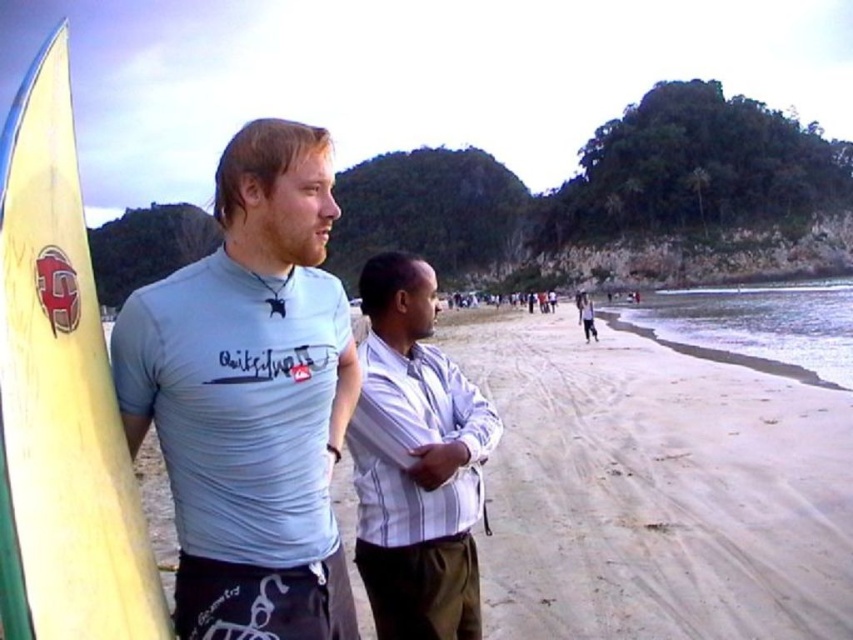
Is point (323, 387) positioned after point (119, 541)?

Yes.

Does point (297, 147) come closer to viewer compared to point (82, 484)?

No, it is not.

Find the location of a particular element. This screenshot has height=640, width=853. light blue fabric shirt at left is located at coordinates (250, 396).

Does yellow matte surfboard at left appear on the left side of white striped shirt at center?

Yes, yellow matte surfboard at left is to the left of white striped shirt at center.

Is yellow matte surfboard at left thinner than white striped shirt at center?

Incorrect, yellow matte surfboard at left's width is not less than white striped shirt at center's.

Is point (62, 150) positioned before point (419, 515)?

Yes, it is in front of point (419, 515).

Where is `yellow matte surfboard at left`? Image resolution: width=853 pixels, height=640 pixels. yellow matte surfboard at left is located at coordinates (61, 397).

Who is lower down, light blue fabric shirt at left or white striped shirt at center?

white striped shirt at center is lower down.

Which of these two, light blue fabric shirt at left or white striped shirt at center, stands taller?

With more height is light blue fabric shirt at left.

Between point (229, 636) and point (376, 609), which one is positioned behind?

Positioned behind is point (376, 609).

The image size is (853, 640). What are the coordinates of `light blue fabric shirt at left` in the screenshot? It's located at (250, 396).